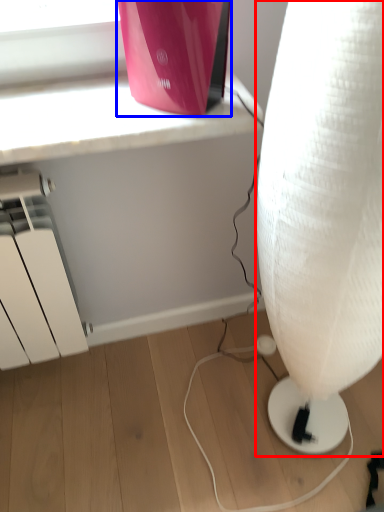
Question: Which object appears farthest to the camera in this image, lamp (highlighted by a red box) or appliance (highlighted by a blue box)?

Choices:
 (A) lamp
 (B) appliance

Answer: (B)